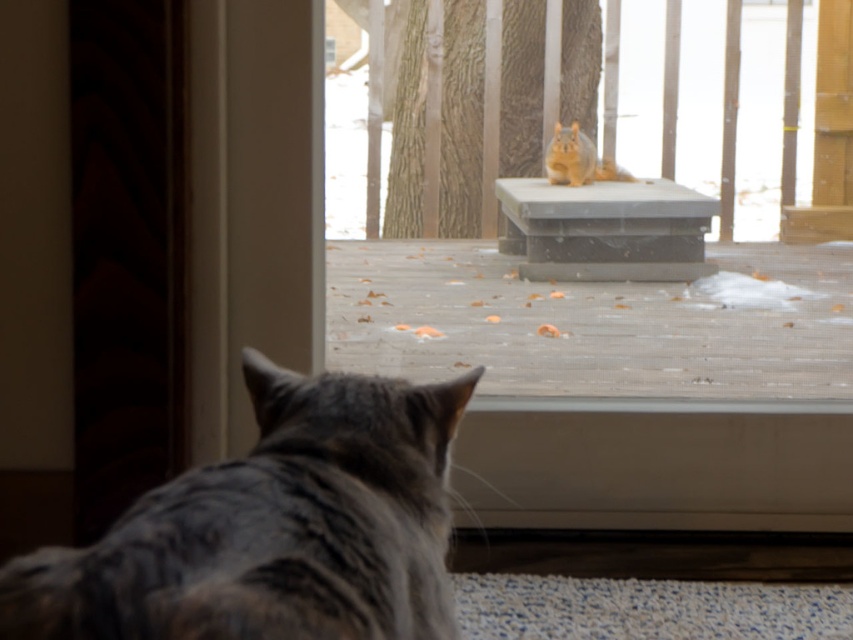
You are a photographer trying to capture both the gray fur cat at lower left and the blonde fur squirrel at upper center in a single shot. Based on their positions, which animal would appear larger in the photo?

The gray fur cat at lower left would appear much larger in the photo since it is taller than the blonde fur squirrel at upper center.

You are a photographer trying to capture a photo of the gray fur cat at lower left and the blonde fur squirrel at upper center through the screen door. Since the screen door may obstruct the view, you want to know which animal is bigger to adjust your camera settings. Which one is larger?

The gray fur cat at lower left is larger in size than the blonde fur squirrel at upper center, so you should adjust your camera settings for the gray fur cat at lower left.

You are standing at the screen door looking out. There are two points marked in the scene. The first point is at coordinates point (157,618) and the second is at point (606,157). Which point is closer to you?

Point (157,618) is closer to you because it is in front of point (606,157).